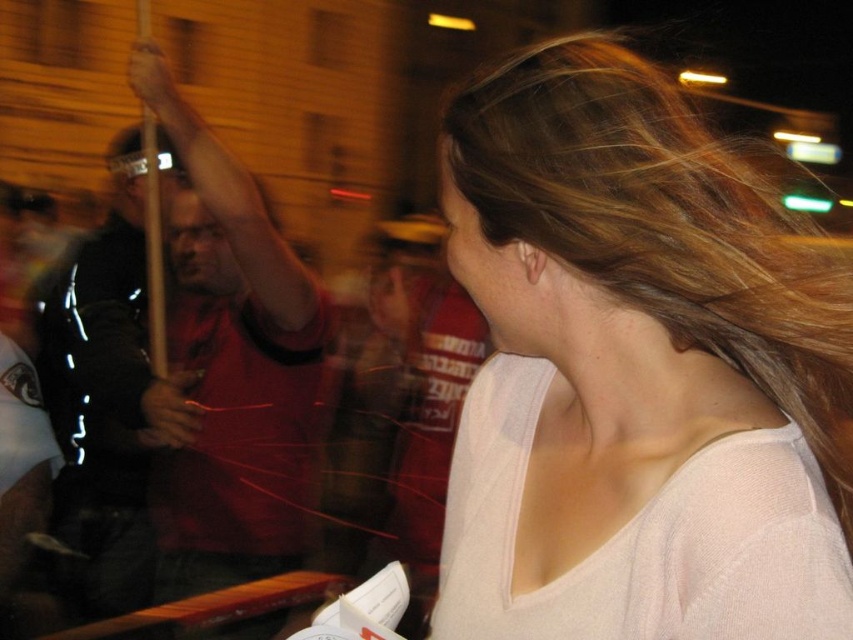
Question: Is light pink sweater at center closer to camera compared to matte red shirt at left?

Choices:
 (A) yes
 (B) no

Answer: (A)

Question: Can you confirm if light pink sweater at center is positioned above matte red shirt at left?

Choices:
 (A) no
 (B) yes

Answer: (B)

Question: Which object is closer to the camera taking this photo?

Choices:
 (A) light pink sweater at center
 (B) matte red shirt at left

Answer: (A)

Question: Does light pink sweater at center appear on the left side of matte red shirt at left?

Choices:
 (A) yes
 (B) no

Answer: (B)